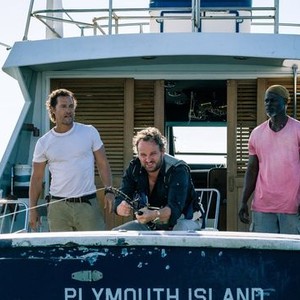
Where is `window`? This screenshot has height=300, width=300. window is located at coordinates (217, 142).